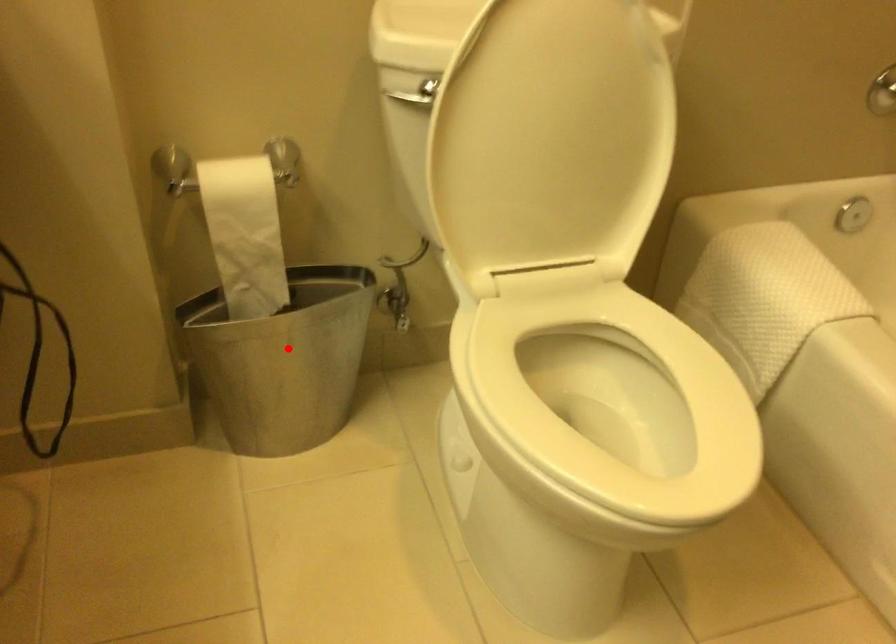
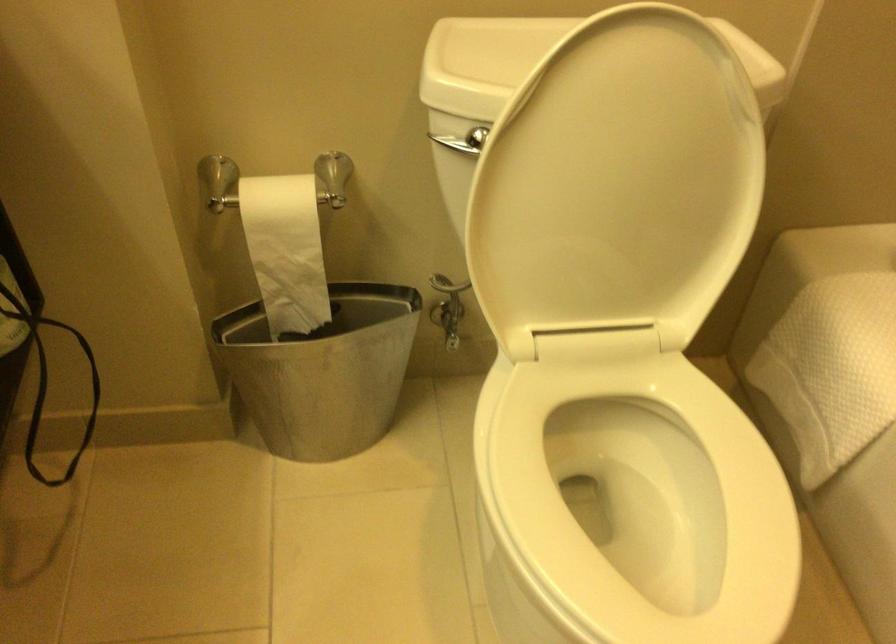
Question: I am providing you with two images of the same scene from different viewpoints. A red point is marked on the first image. Is the red point's position out of view in image 2?

Choices:
 (A) Yes
 (B) No

Answer: (B)